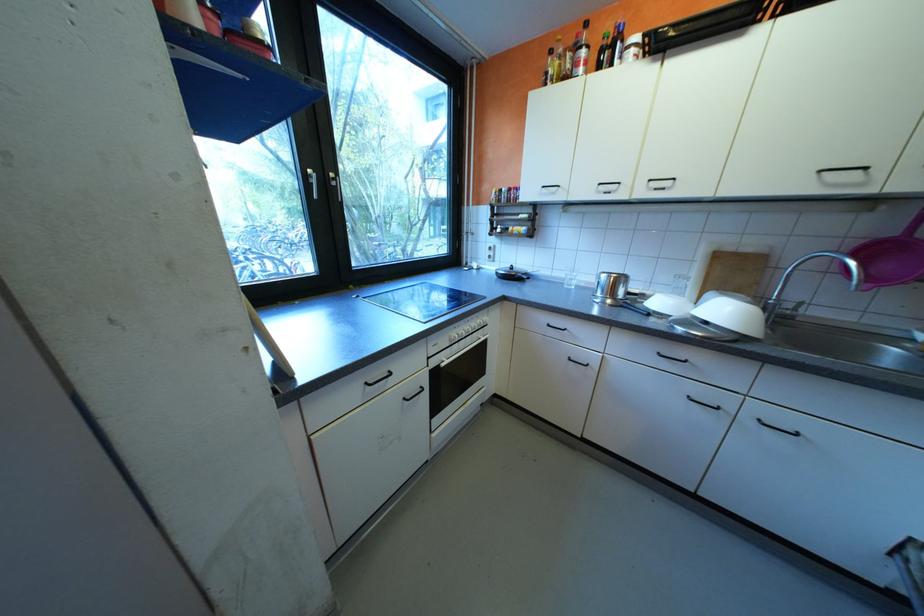
Which object does [569,277] point to?

It refers to a clear drinking glass.